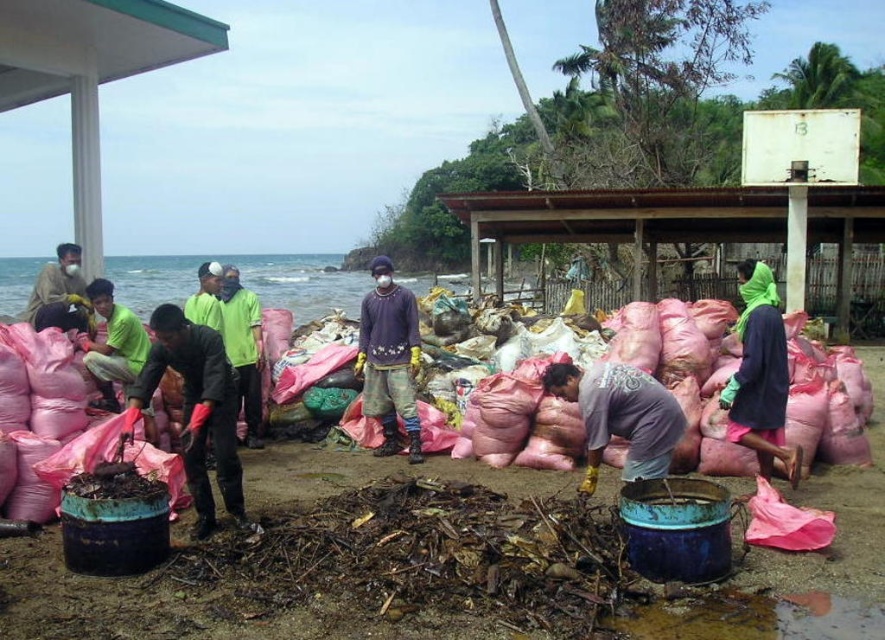
Does pink plastic bags at center have a lesser width compared to purple matte shirt at center?

Indeed, pink plastic bags at center has a lesser width compared to purple matte shirt at center.

Which is behind, point (6, 593) or point (395, 403)?

Point (395, 403)

Is point (279, 468) positioned before point (373, 260)?

That is True.

The height and width of the screenshot is (640, 885). In order to click on pink plastic bags at center in this screenshot , I will do `click(181, 608)`.

Which is behind, point (155, 596) or point (75, 296)?

The point (75, 296) is more distant.

Which is above, pink plastic bags at center or brown leather jacket at upper left?

brown leather jacket at upper left is higher up.

Which is behind, point (835, 636) or point (73, 304)?

Point (73, 304)

Find the location of `pink plastic bags at center`. pink plastic bags at center is located at coordinates (181, 608).

Between brown leather jacket at upper left and green fabric shirt at center, which one has more height?

brown leather jacket at upper left

Is point (36, 300) farther from viewer compared to point (193, 298)?

No, it is in front of (193, 298).

What do you see at coordinates (59, 284) in the screenshot? I see `brown leather jacket at upper left` at bounding box center [59, 284].

Where is `brown leather jacket at upper left`? Image resolution: width=885 pixels, height=640 pixels. brown leather jacket at upper left is located at coordinates (59, 284).